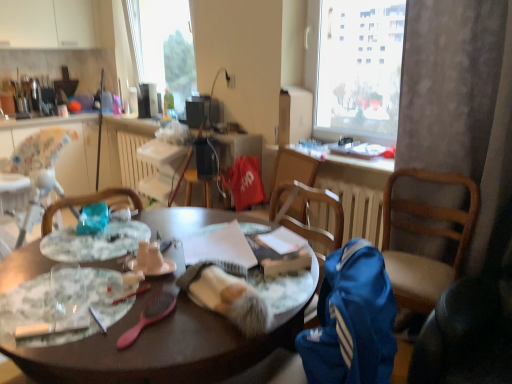
What are the coordinates of `free location in front of matte white coffee cup at center` in the screenshot? It's located at (146, 316).